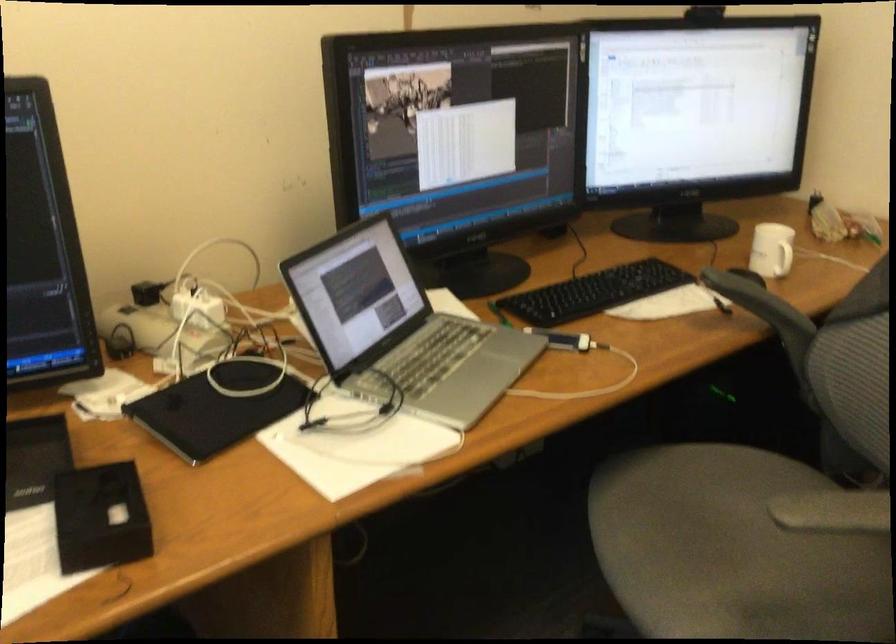
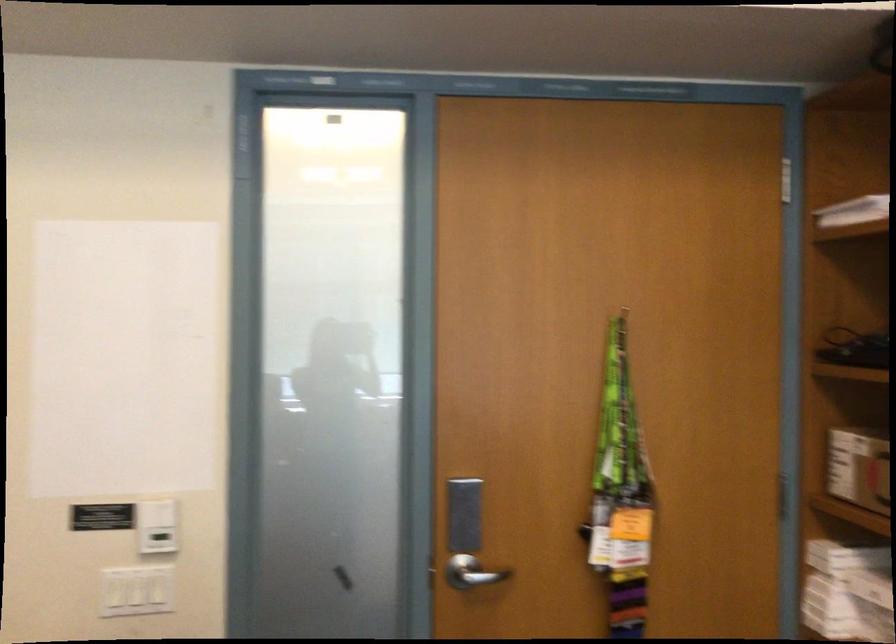
Question: The camera is either moving clockwise (left) or counter-clockwise (right) around the object. The first image is from the beginning of the video and the second image is from the end. Is the camera moving left or right when shooting the video?

Choices:
 (A) Left
 (B) Right

Answer: (A)